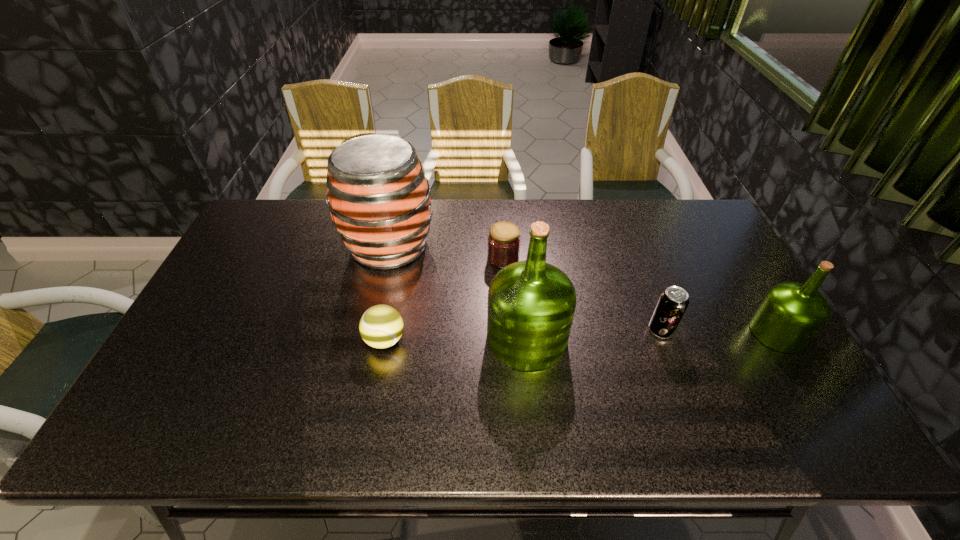
The height and width of the screenshot is (540, 960). In order to click on vacant area at the right edge of the desktop in this screenshot , I will do (x=734, y=366).

In the image, there is a desktop. Find the location of `free space at the far left corner`. free space at the far left corner is located at coordinates (282, 200).

I want to click on vacant space at the near left corner of the desktop, so click(x=188, y=395).

Find the location of `free space at the far right corner of the desktop`. free space at the far right corner of the desktop is located at coordinates (684, 216).

Find the location of `unoccupied position between the shorter olive oil and the jam`. unoccupied position between the shorter olive oil and the jam is located at coordinates (640, 295).

This screenshot has width=960, height=540. I want to click on vacant area that lies between the tennis ball and the rightmost object, so click(581, 336).

Locate an element on the screen. The width and height of the screenshot is (960, 540). vacant area between the cider and the tennis ball is located at coordinates (387, 293).

I want to click on vacant space that is in between the fifth object from left to right and the right olive oil, so click(719, 331).

Where is `unoccupied area between the cider and the tennis ball`? The height and width of the screenshot is (540, 960). unoccupied area between the cider and the tennis ball is located at coordinates (387, 293).

At what (x,y) coordinates should I click in order to perform the action: click on unoccupied area between the rightmost object and the jam. Please return your answer as a coordinate pair (x, y). The height and width of the screenshot is (540, 960). Looking at the image, I should click on (640, 295).